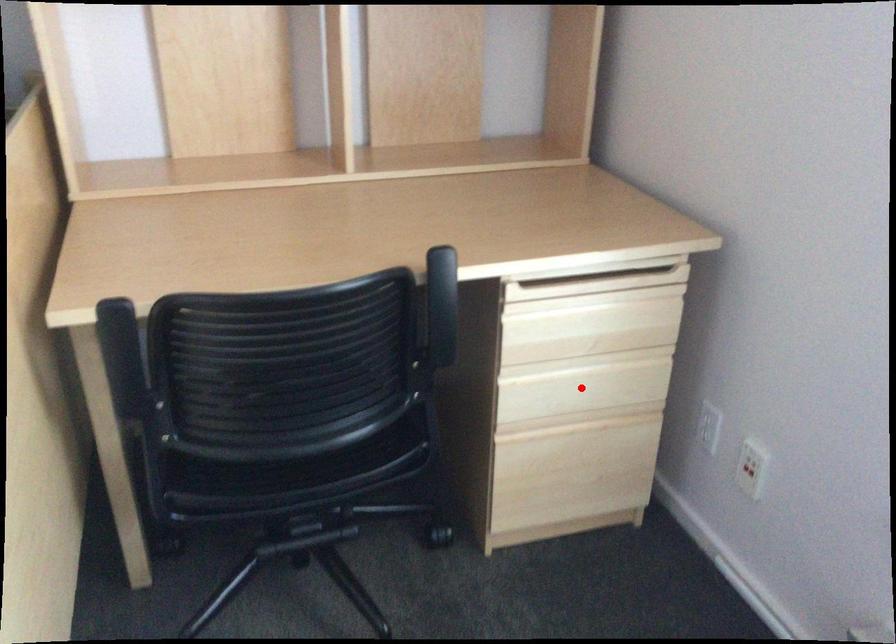
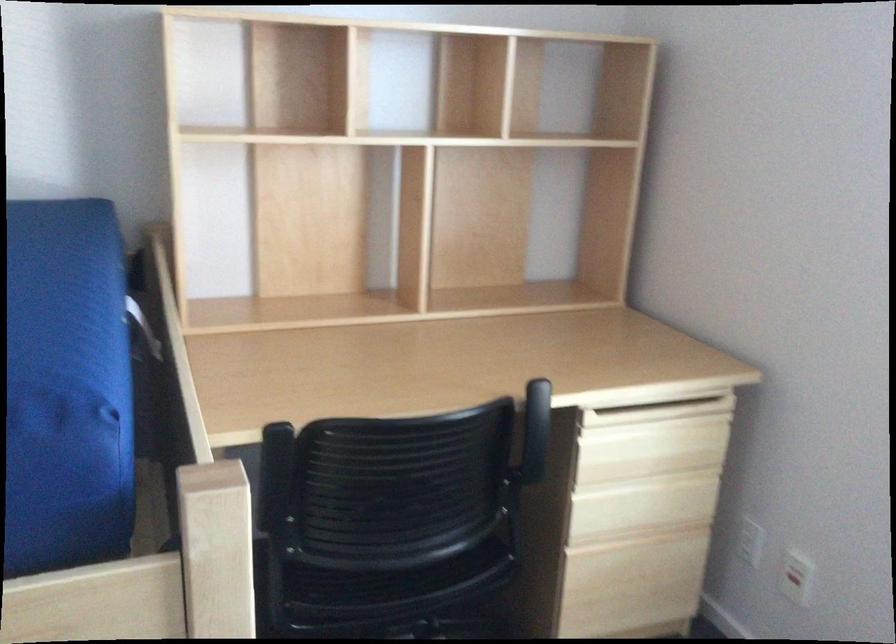
Question: A red point is marked in image1. In image2, is the corresponding 3D point closer to the camera or farther? Reply with the corresponding letter.

Choices:
 (A) The corresponding 3D point is closer.
 (B) The corresponding 3D point is farther.

Answer: (B)